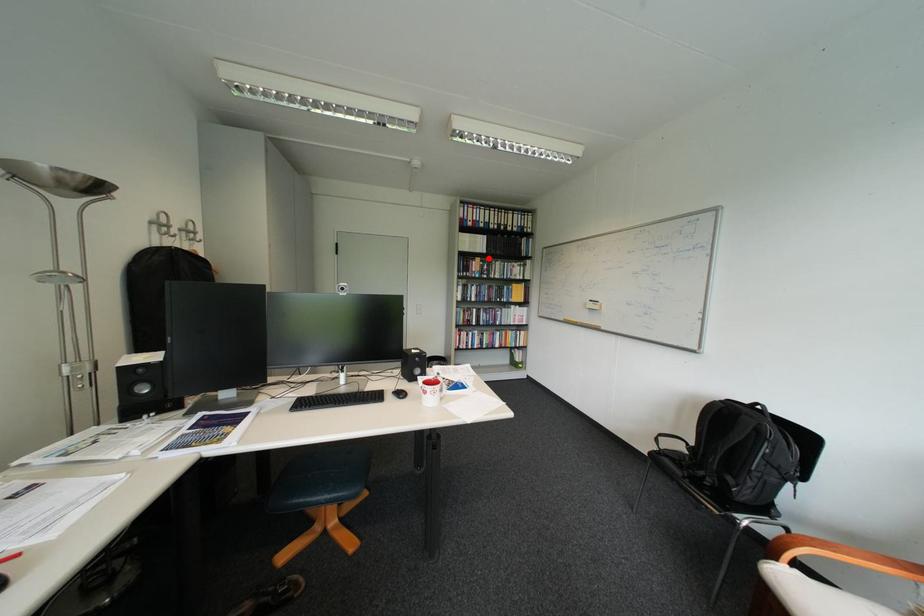
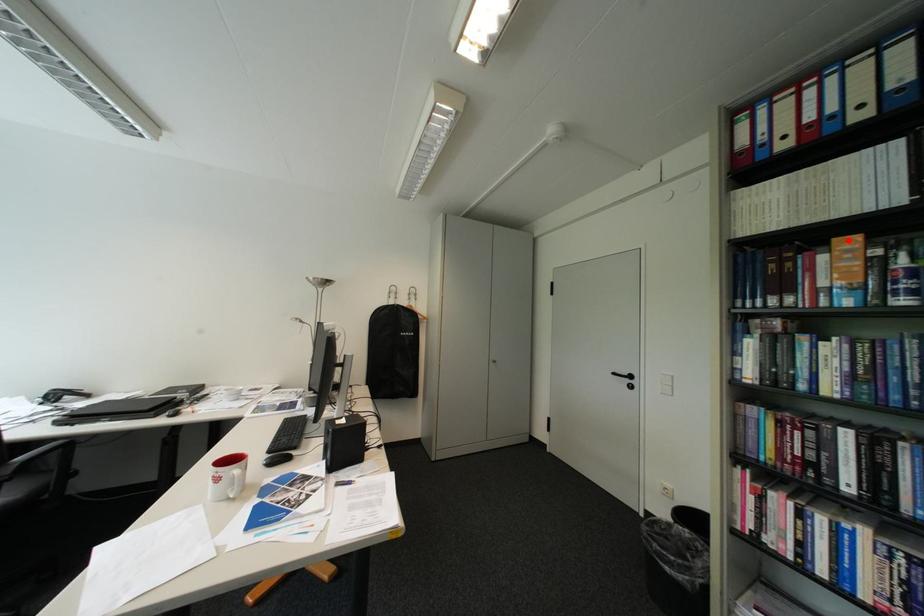
I am providing you with two images of the same scene from different viewpoints. A red point is marked on the first image and another point is marked on the second image. Are the points marked in image1 and image2 representing the same 3D position?

Yes